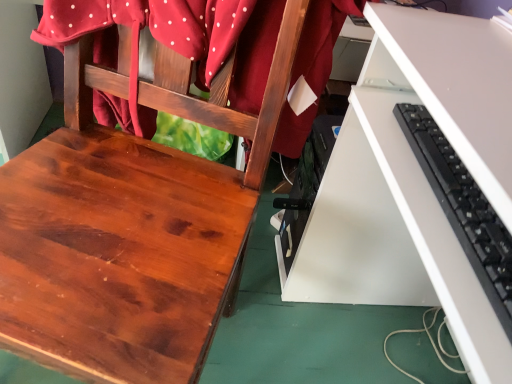
Question: Considering the relative sizes of black plastic keyboard at right and white matte desk at lower right in the image provided, is black plastic keyboard at right thinner than white matte desk at lower right?

Choices:
 (A) no
 (B) yes

Answer: (B)

Question: Is the position of black plastic keyboard at right less distant than that of white matte desk at lower right?

Choices:
 (A) yes
 (B) no

Answer: (B)

Question: Is the position of black plastic keyboard at right more distant than that of white matte desk at lower right?

Choices:
 (A) no
 (B) yes

Answer: (B)

Question: From the image's perspective, is black plastic keyboard at right beneath white matte desk at lower right?

Choices:
 (A) yes
 (B) no

Answer: (B)

Question: Is black plastic keyboard at right positioned beyond the bounds of white matte desk at lower right?

Choices:
 (A) yes
 (B) no

Answer: (B)

Question: Is black plastic keyboard at right oriented towards white matte desk at lower right?

Choices:
 (A) yes
 (B) no

Answer: (A)

Question: Is shiny wood chair at center thinner than matte red fabric at upper left?

Choices:
 (A) yes
 (B) no

Answer: (B)

Question: From the image's perspective, is shiny wood chair at center below matte red fabric at upper left?

Choices:
 (A) yes
 (B) no

Answer: (A)

Question: Is shiny wood chair at center at the left side of matte red fabric at upper left?

Choices:
 (A) yes
 (B) no

Answer: (A)

Question: Is the depth of shiny wood chair at center less than that of matte red fabric at upper left?

Choices:
 (A) no
 (B) yes

Answer: (B)

Question: From a real-world perspective, is shiny wood chair at center located higher than matte red fabric at upper left?

Choices:
 (A) no
 (B) yes

Answer: (A)

Question: Does shiny wood chair at center have a smaller size compared to matte red fabric at upper left?

Choices:
 (A) no
 (B) yes

Answer: (A)

Question: Is black plastic keyboard at right beside shiny wood chair at center?

Choices:
 (A) yes
 (B) no

Answer: (B)